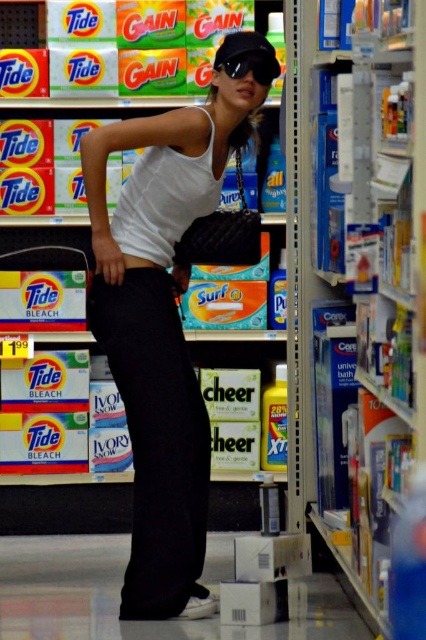
Question: Which point is closer to the camera?

Choices:
 (A) matte black purse at center
 (B) blue cardboard boxes at center

Answer: (B)

Question: Is blue cardboard boxes at center thinner than black matte sunglasses at upper center?

Choices:
 (A) no
 (B) yes

Answer: (B)

Question: Which point is closer to the camera?

Choices:
 (A) (103, 128)
 (B) (218, 65)
 (C) (199, 433)
 (D) (328, 422)

Answer: (A)

Question: Does blue cardboard boxes at center appear on the left side of black matte pants at lower center?

Choices:
 (A) no
 (B) yes

Answer: (A)

Question: Where is blue cardboard boxes at center located in relation to matte black purse at center in the image?

Choices:
 (A) below
 (B) above

Answer: (B)

Question: Estimate the real-world distances between objects in this image. Which object is farther from the matte black purse at center?

Choices:
 (A) blue cardboard boxes at center
 (B) black matte sunglasses at upper center

Answer: (A)